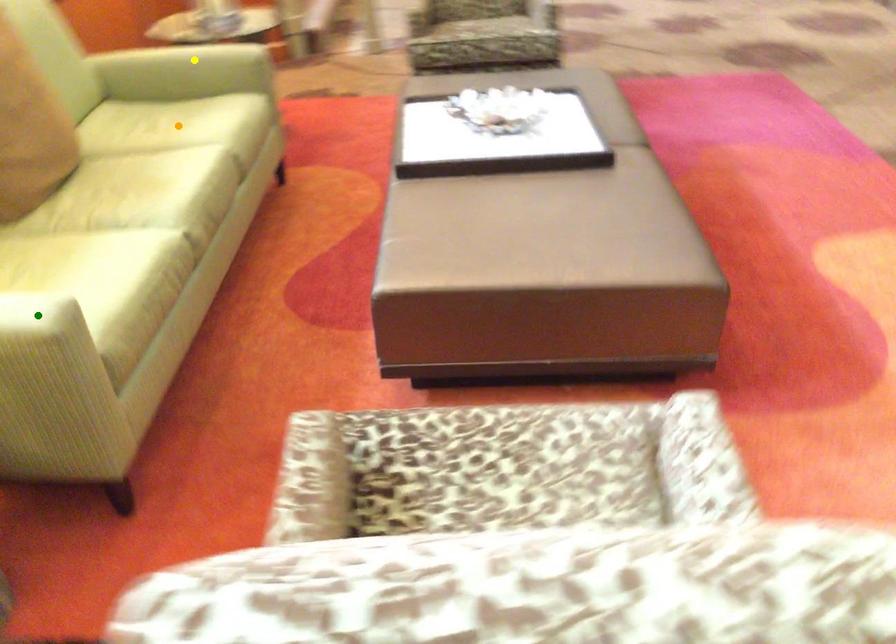
Order these from nearest to farthest:
orange point
green point
yellow point

yellow point → orange point → green point